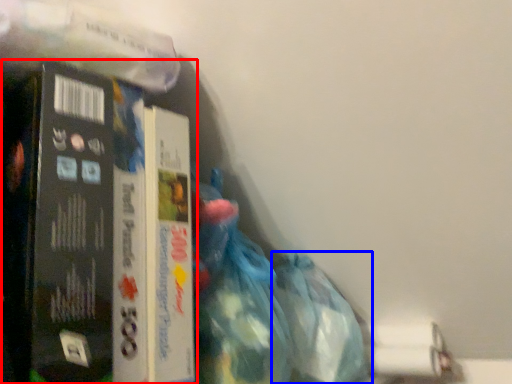
Question: Which object is further to the camera taking this photo, book (highlighted by a red box) or plastic bag (highlighted by a blue box)?

Choices:
 (A) book
 (B) plastic bag

Answer: (B)